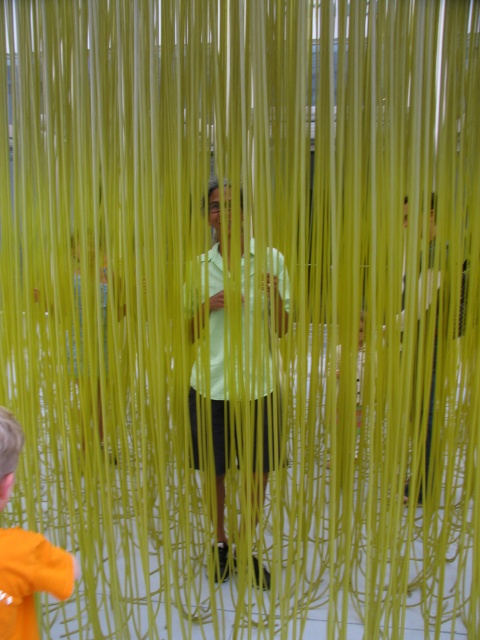
You are a fashion designer observing the scene. You notice two items of light green fabric. One is the light green fabric at center and the other is the light green fabric shirt at center. Which of these two items is taller?

The light green fabric at center is taller than the light green fabric shirt at center.

Based on the coordinates provided, where is the light green fabric shirt at center located in the image?

The light green fabric shirt at center is located at the 2D coordinates point [237,344] in the image.

Based on the photo, you are standing in the room and want to move from the point at coordinates point (x=210, y=321) to the point at coordinates point (x=58, y=596). Which direction should you move?

You should move towards the lower right direction because point (x=58, y=596) is closer to the viewer than point (x=210, y=321), so moving towards it would be in the lower right direction.